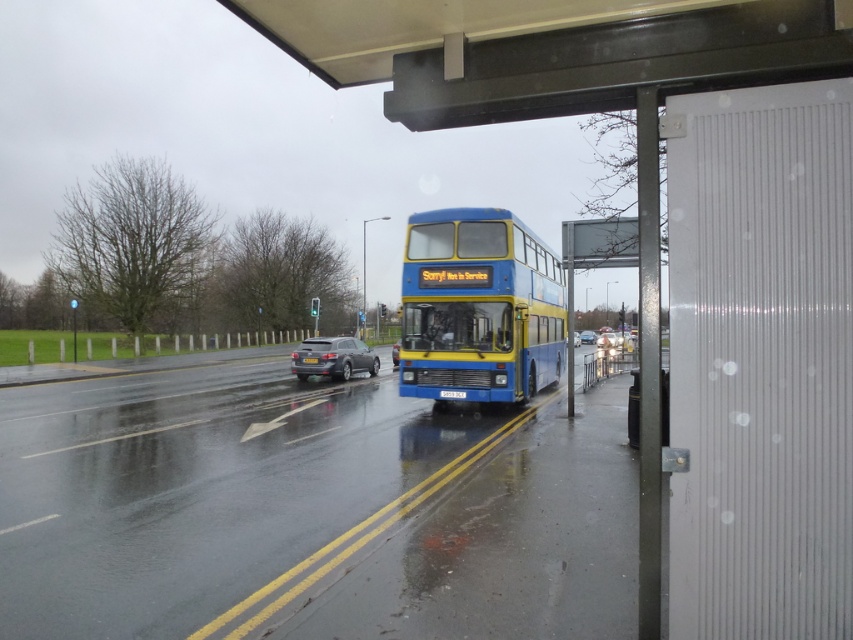
Question: Among these points, which one is farthest from the camera?

Choices:
 (A) (445, 289)
 (B) (585, 333)

Answer: (B)

Question: Which object is the farthest from the metallic silver car at center?

Choices:
 (A) blue metallic license plate at center
 (B) satin black sedan at center
 (C) blue/yellow painted double-decker bus at center

Answer: (A)

Question: Which object is the closest to the blue/yellow painted double-decker bus at center?

Choices:
 (A) metallic silver car at center
 (B) blue metallic license plate at center
 (C) satin black sedan at center

Answer: (B)

Question: Does blue/yellow painted double-decker bus at center have a smaller size compared to metallic silver car at center?

Choices:
 (A) yes
 (B) no

Answer: (B)

Question: Does blue/yellow painted double-decker bus at center have a greater width compared to satin black sedan at center?

Choices:
 (A) no
 (B) yes

Answer: (B)

Question: Is blue/yellow painted double-decker bus at center wider than metallic silver car at center?

Choices:
 (A) yes
 (B) no

Answer: (A)